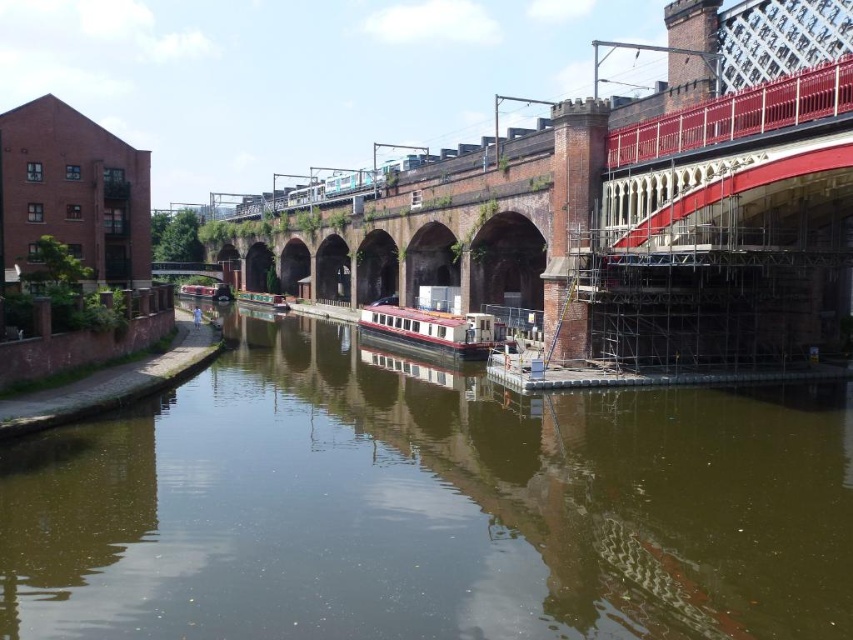
Can you confirm if brick red bridge at upper center is smaller than matte red houseboat at center?

Incorrect, brick red bridge at upper center is not smaller in size than matte red houseboat at center.

Describe the element at coordinates (607, 230) in the screenshot. This screenshot has width=853, height=640. I see `brick red bridge at upper center` at that location.

Which is in front, point (546, 243) or point (474, 349)?

Positioned in front is point (546, 243).

Find the location of a particular element. brick red bridge at upper center is located at coordinates (607, 230).

Between point (480, 589) and point (821, 67), which one is positioned in front?

Point (480, 589) is in front.

Between green reflective water at center and brick red bridge at upper center, which one has less height?

With less height is green reflective water at center.

Between point (225, 428) and point (643, 266), which one is positioned behind?

The point (643, 266) is behind.

Identify the location of green reflective water at center. (428, 508).

Does green reflective water at center have a lesser width compared to matte red houseboat at center?

No, green reflective water at center is not thinner than matte red houseboat at center.

Can you confirm if green reflective water at center is taller than matte red houseboat at center?

Indeed, green reflective water at center has a greater height compared to matte red houseboat at center.

Where is `green reflective water at center`? green reflective water at center is located at coordinates (428, 508).

Image resolution: width=853 pixels, height=640 pixels. Find the location of `green reflective water at center`. green reflective water at center is located at coordinates (428, 508).